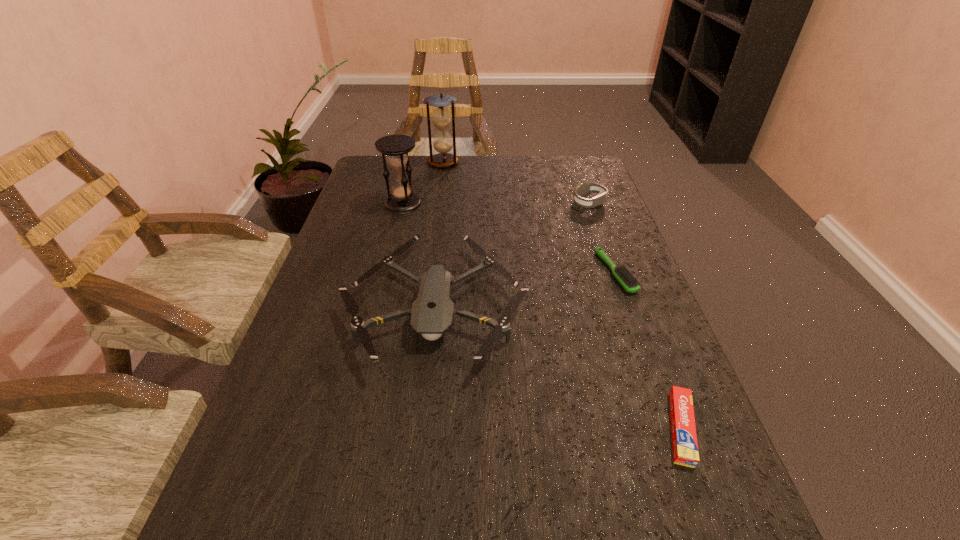
Locate an element on the screen. blank space that satisfies the following two spatial constraints: 1. on the face of the hairbrush; 2. on the right side of the watch is located at coordinates (613, 273).

The image size is (960, 540). Identify the location of vacant space that satisfies the following two spatial constraints: 1. on the face of the watch; 2. with a camera mounted on the front of the drone. (624, 304).